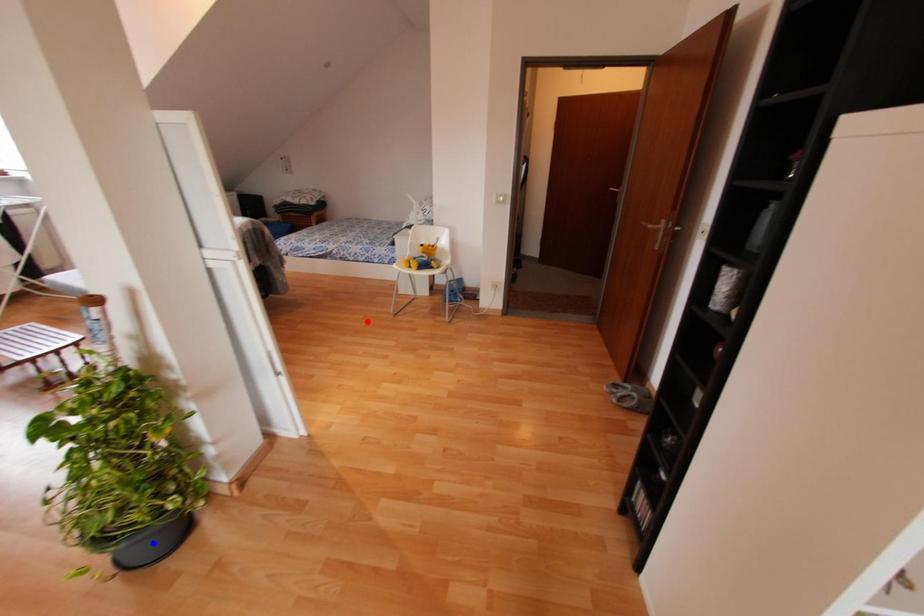
Question: Two points are marked on the image. Which point is closer to the camera?

Choices:
 (A) Blue point is closer.
 (B) Red point is closer.

Answer: (A)